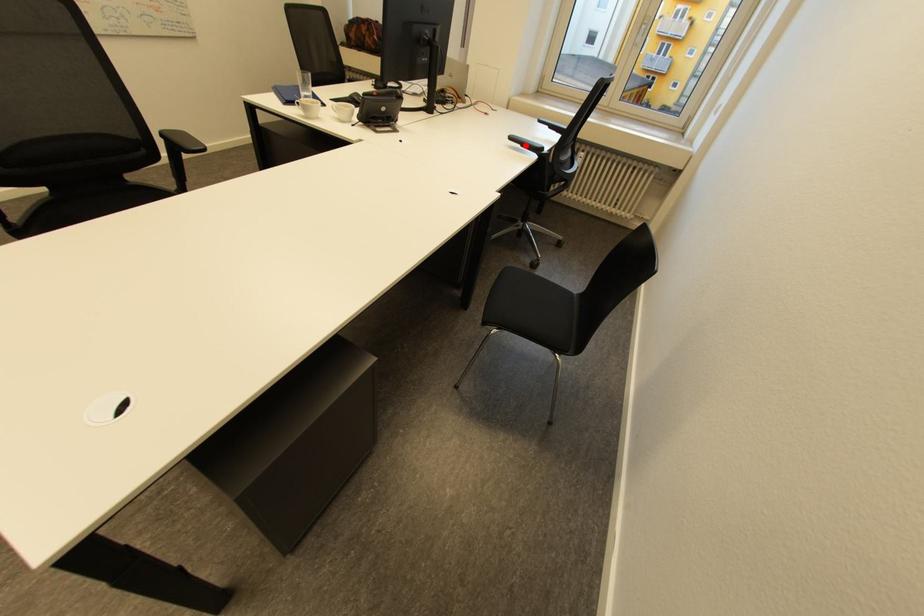
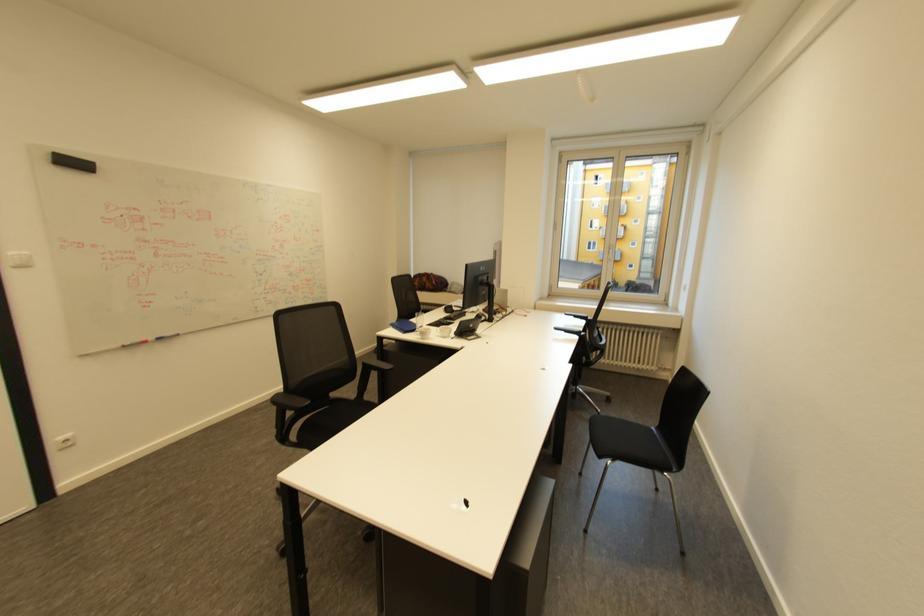
Where in the second image is the point corresponding to the highlighted location from the first image?

(570, 333)